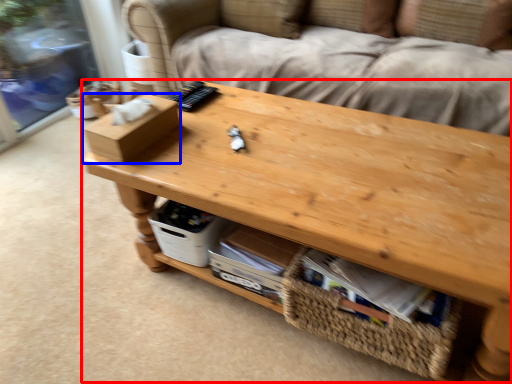
Question: Which of the following is the farthest to the observer, table (highlighted by a red box) or box (highlighted by a blue box)?

Choices:
 (A) table
 (B) box

Answer: (B)